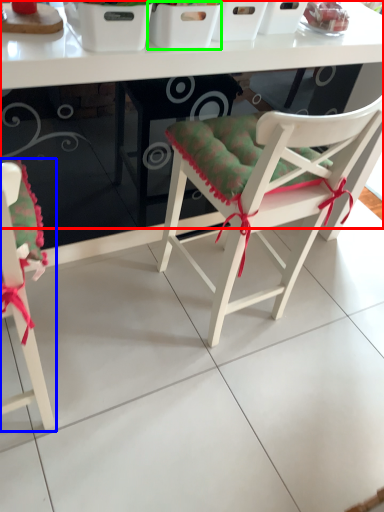
Question: Which object is the farthest from table (highlighted by a red box)? Choose among these: chair (highlighted by a blue box) or basket (highlighted by a green box).

Choices:
 (A) chair
 (B) basket

Answer: (A)